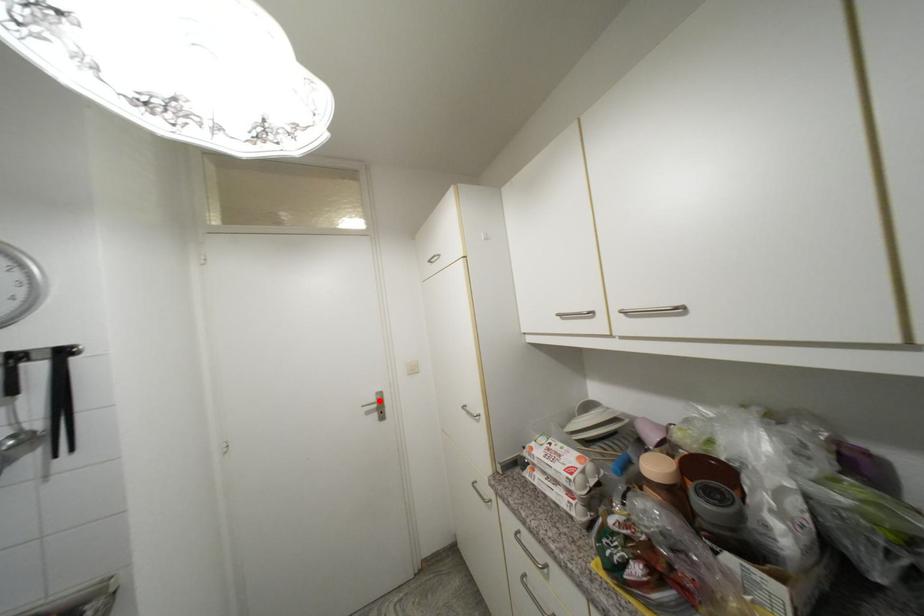
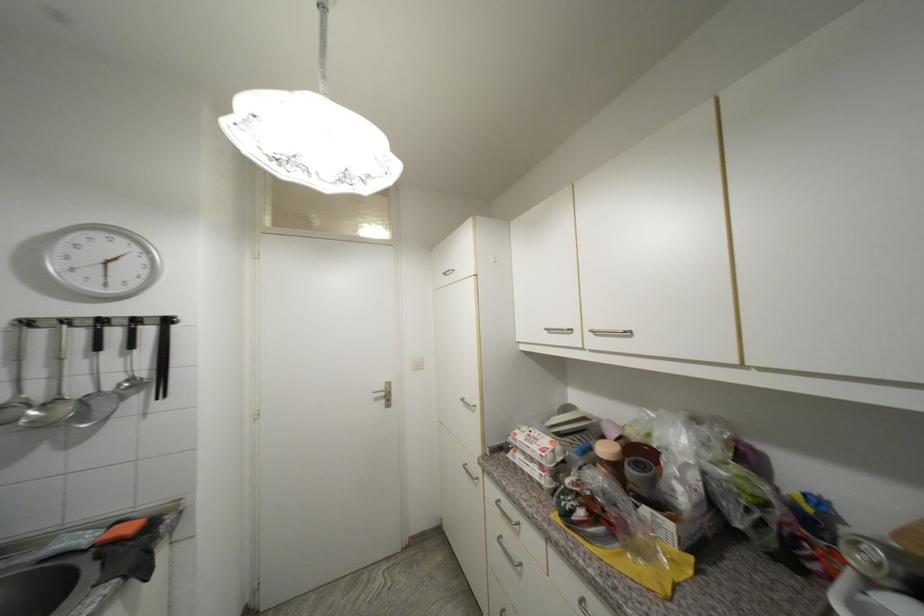
In the second image, find the point that corresponds to the highlighted location in the first image.

(388, 390)